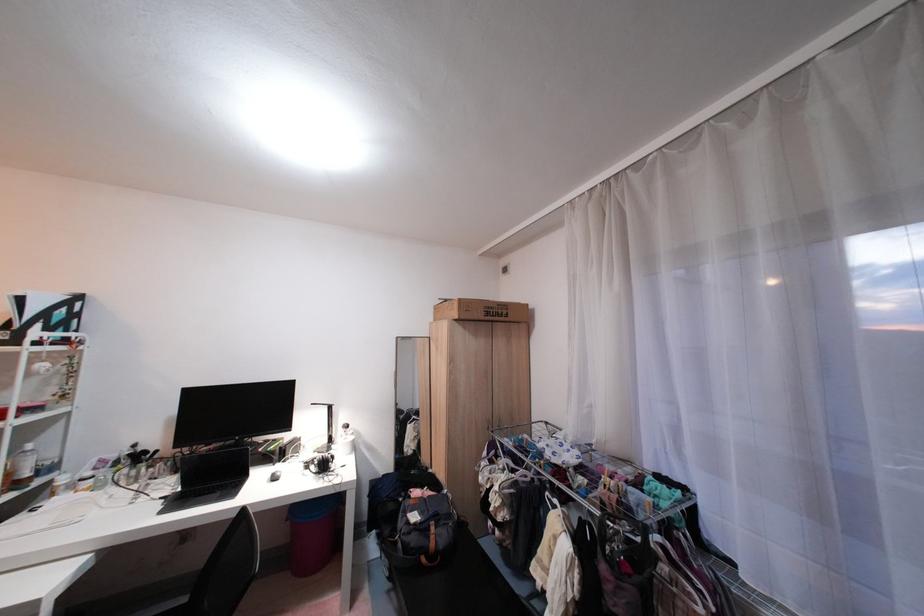
I want to click on black laptop, so click(209, 477).